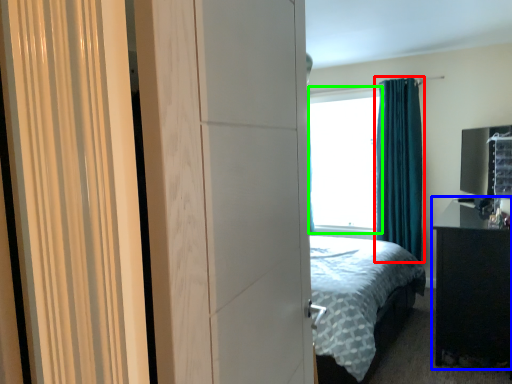
Question: Estimate the real-world distances between objects in this image. Which object is farther from curtain (highlighted by a red box), nightstand (highlighted by a blue box) or window screen (highlighted by a green box)?

Choices:
 (A) nightstand
 (B) window screen

Answer: (A)